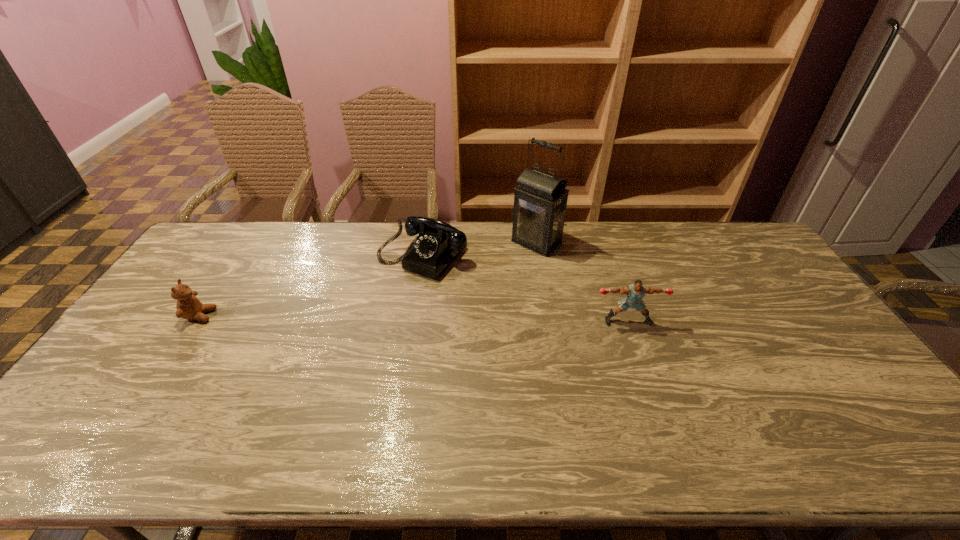
This screenshot has height=540, width=960. I want to click on blank region between the tallest object and the second object from left to right, so click(480, 248).

This screenshot has width=960, height=540. Find the location of `vacant point located between the shortest object and the puncher`. vacant point located between the shortest object and the puncher is located at coordinates (414, 318).

At what (x,y) coordinates should I click in order to perform the action: click on vacant area that lies between the puncher and the second object from left to right. Please return your answer as a coordinate pair (x, y). The image size is (960, 540). Looking at the image, I should click on (525, 288).

This screenshot has height=540, width=960. I want to click on object that is the closest one to the leftmost object, so click(x=438, y=243).

Where is `the second closest object to the third object from left to right`? This screenshot has width=960, height=540. the second closest object to the third object from left to right is located at coordinates (635, 292).